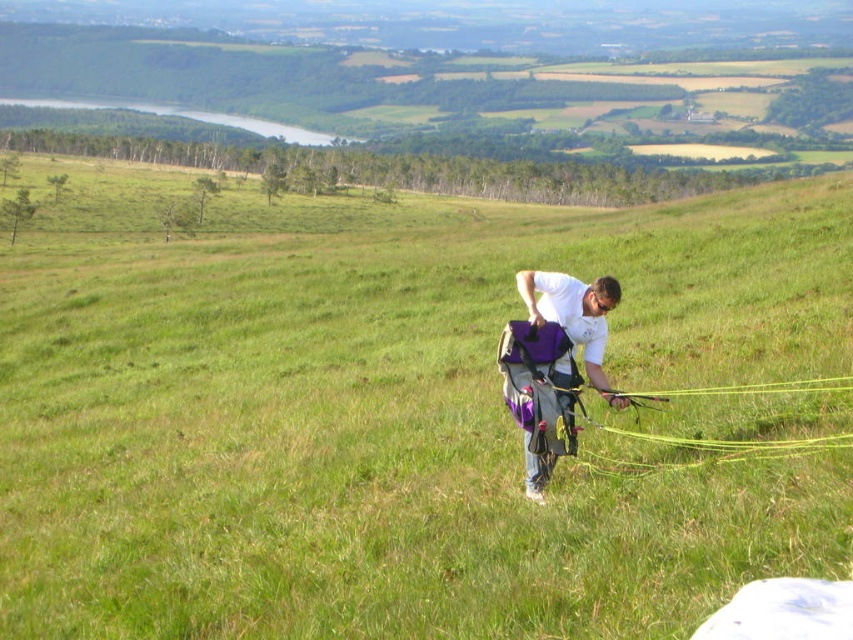
Which is behind, point (646, 433) or point (573, 320)?

The point (646, 433) is more distant.

Does yellow string at center appear on the right side of purple fabric backpack at center?

Indeed, yellow string at center is positioned on the right side of purple fabric backpack at center.

You are a GUI agent. You are given a task and a screenshot of the screen. Output one action in this format:
    pyautogui.click(x=<x>, y=<y>)
    Task: Click on the yellow string at center
    The width and height of the screenshot is (853, 640).
    Given the screenshot: What is the action you would take?
    pyautogui.click(x=711, y=449)

Locate an element on the screen. yellow string at center is located at coordinates (711, 449).